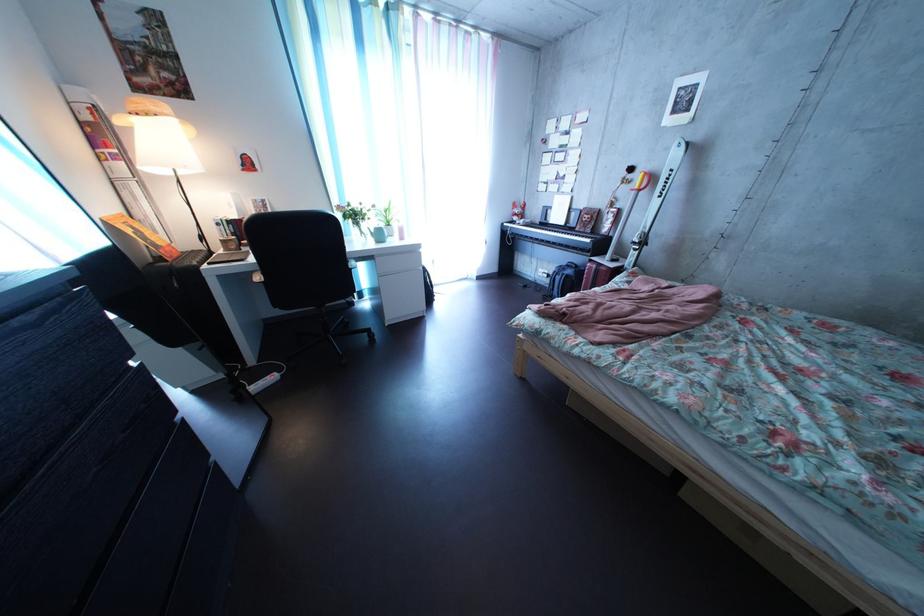
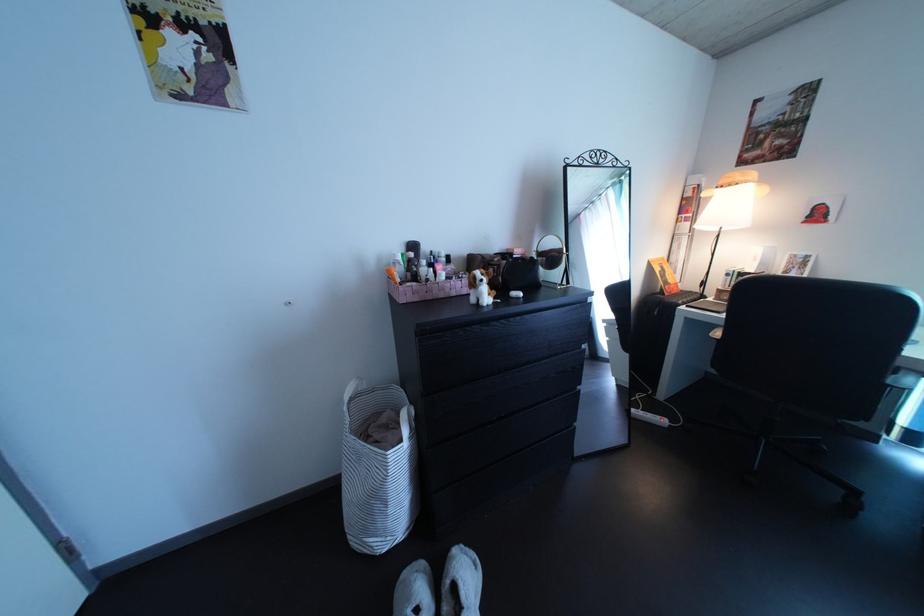
In the second image, find the point that corresponds to [93,103] in the first image.

(709, 188)